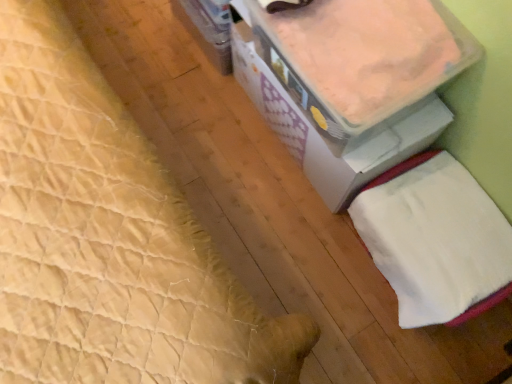
This screenshot has height=384, width=512. What do you see at coordinates (435, 240) in the screenshot? I see `white soft towel at lower right` at bounding box center [435, 240].

Find the location of a particular element. white soft towel at lower right is located at coordinates (435, 240).

Describe the element at coordinates (353, 83) in the screenshot. I see `white cardboard storage box at upper right` at that location.

Where is `white cardboard storage box at upper right`? The height and width of the screenshot is (384, 512). white cardboard storage box at upper right is located at coordinates (353, 83).

Locate an element on the screen. The height and width of the screenshot is (384, 512). white soft towel at lower right is located at coordinates (435, 240).

Considering the relative positions of white cardboard storage box at upper right and white soft towel at lower right in the image provided, is white cardboard storage box at upper right to the left or to the right of white soft towel at lower right?

From the image, it's evident that white cardboard storage box at upper right is to the left of white soft towel at lower right.

Which is behind, white cardboard storage box at upper right or white soft towel at lower right?

Positioned behind is white soft towel at lower right.

Is point (250, 17) positioned after point (419, 230)?

Yes, point (250, 17) is farther from viewer.

From the image's perspective, is white cardboard storage box at upper right positioned above or below white soft towel at lower right?

Based on their image positions, white cardboard storage box at upper right is located above white soft towel at lower right.

From a real-world perspective, which is physically below, white cardboard storage box at upper right or white soft towel at lower right?

From a 3D spatial view, white soft towel at lower right is below.

Considering the relative sizes of white cardboard storage box at upper right and white soft towel at lower right in the image provided, is white cardboard storage box at upper right thinner than white soft towel at lower right?

No, white cardboard storage box at upper right is not thinner than white soft towel at lower right.

Does white cardboard storage box at upper right have a greater height compared to white soft towel at lower right?

In fact, white cardboard storage box at upper right may be shorter than white soft towel at lower right.

Does white cardboard storage box at upper right have a smaller size compared to white soft towel at lower right?

Indeed, white cardboard storage box at upper right has a smaller size compared to white soft towel at lower right.

Is white soft towel at lower right inside white cardboard storage box at upper right?

No, white soft towel at lower right is not a part of white cardboard storage box at upper right.

Is white cardboard storage box at upper right not close to white soft towel at lower right?

white cardboard storage box at upper right is actually quite close to white soft towel at lower right.

Is white cardboard storage box at upper right oriented towards white soft towel at lower right?

No, white cardboard storage box at upper right is not turned towards white soft towel at lower right.

What's the angular difference between white cardboard storage box at upper right and white soft towel at lower right's facing directions?

The angular difference between white cardboard storage box at upper right and white soft towel at lower right is 0.000173 degrees.

Where is `storage box that appears on the left of white soft towel at lower right`? storage box that appears on the left of white soft towel at lower right is located at coordinates (353, 83).

Does white soft towel at lower right appear on the right side of white cardboard storage box at upper right?

Indeed, white soft towel at lower right is positioned on the right side of white cardboard storage box at upper right.

Considering their positions, is white soft towel at lower right located in front of or behind white cardboard storage box at upper right?

In the image, white soft towel at lower right appears behind white cardboard storage box at upper right.

Is point (453, 194) farther from camera compared to point (447, 68)?

Yes, point (453, 194) is behind point (447, 68).

From the image's perspective, which one is positioned higher, white soft towel at lower right or white cardboard storage box at upper right?

white cardboard storage box at upper right appears higher in the image.

From a real-world perspective, who is located higher, white soft towel at lower right or white cardboard storage box at upper right?

white cardboard storage box at upper right.

Which object is thinner, white soft towel at lower right or white cardboard storage box at upper right?

With smaller width is white soft towel at lower right.

Who is taller, white soft towel at lower right or white cardboard storage box at upper right?

Standing taller between the two is white soft towel at lower right.

In terms of size, does white soft towel at lower right appear bigger or smaller than white cardboard storage box at upper right?

In the image, white soft towel at lower right appears to be larger than white cardboard storage box at upper right.

From the picture: Is white soft towel at lower right inside or outside of white cardboard storage box at upper right?

white soft towel at lower right is spatially situated outside white cardboard storage box at upper right.

Is white soft towel at lower right with white cardboard storage box at upper right?

white soft towel at lower right and white cardboard storage box at upper right are clearly separated.

Does white soft towel at lower right turn towards white cardboard storage box at upper right?

No, white soft towel at lower right does not turn towards white cardboard storage box at upper right.

Measure the distance between white soft towel at lower right and white cardboard storage box at upper right.

white soft towel at lower right is 23.16 centimeters from white cardboard storage box at upper right.

Identify the location of sheet that is under the white cardboard storage box at upper right (from a real-world perspective). (435, 240).

Locate an element on the screen. This screenshot has width=512, height=384. storage box that is above the white soft towel at lower right (from the image's perspective) is located at coordinates [x=353, y=83].

Locate an element on the screen. The height and width of the screenshot is (384, 512). sheet below the white cardboard storage box at upper right (from the image's perspective) is located at coordinates (435, 240).